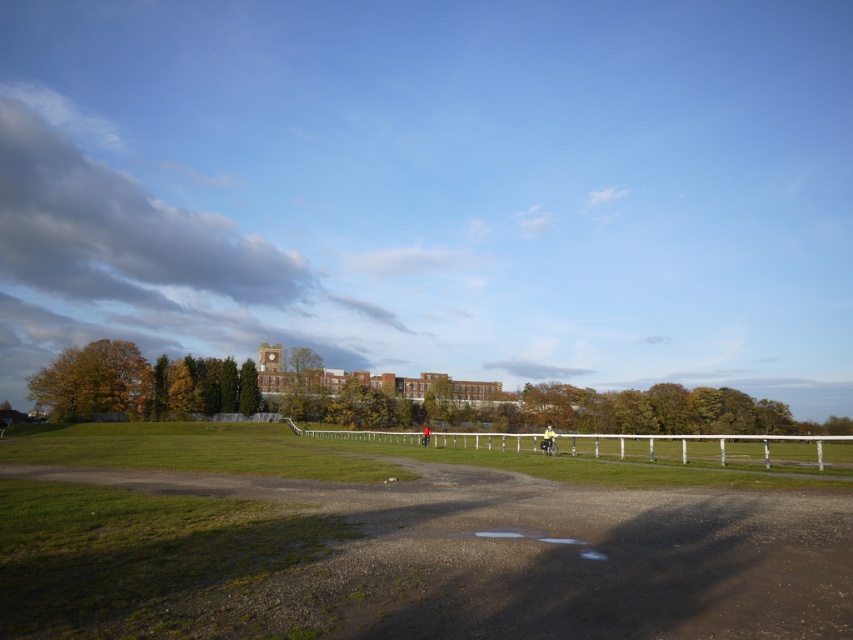
Question: Can you confirm if dirt track at lower center is wider than white wooden fence at center?

Choices:
 (A) yes
 (B) no

Answer: (B)

Question: Which point is closer to the camera?

Choices:
 (A) white wooden fence at center
 (B) dirt track at lower center

Answer: (B)

Question: Can you confirm if dirt track at lower center is wider than white wooden fence at center?

Choices:
 (A) no
 (B) yes

Answer: (A)

Question: Can you confirm if dirt track at lower center is wider than white wooden fence at center?

Choices:
 (A) yes
 (B) no

Answer: (B)